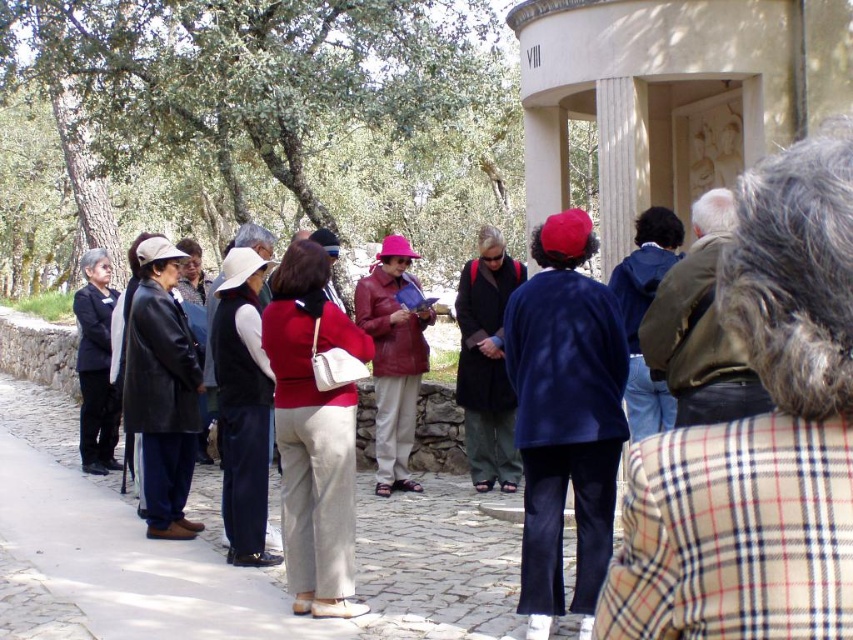
Is point (720, 259) closer to viewer compared to point (177, 531)?

That is True.

Does plaid fabric jacket at center appear over matte black coat at left?

Indeed, plaid fabric jacket at center is positioned over matte black coat at left.

Identify the location of plaid fabric jacket at center. (758, 435).

Does point (776, 556) come closer to viewer compared to point (612, 344)?

Yes, point (776, 556) is in front of point (612, 344).

What do you see at coordinates (758, 435) in the screenshot?
I see `plaid fabric jacket at center` at bounding box center [758, 435].

Identify the location of plaid fabric jacket at center. Image resolution: width=853 pixels, height=640 pixels. (758, 435).

Is green leafy tree at upper left positioned at the back of matte black coat at left?

Yes, it is.

Looking at this image, does green leafy tree at upper left appear on the left side of matte black coat at left?

Correct, you'll find green leafy tree at upper left to the left of matte black coat at left.

Is point (248, 140) less distant than point (154, 429)?

No, (248, 140) is behind (154, 429).

This screenshot has height=640, width=853. I want to click on green leafy tree at upper left, so click(251, 124).